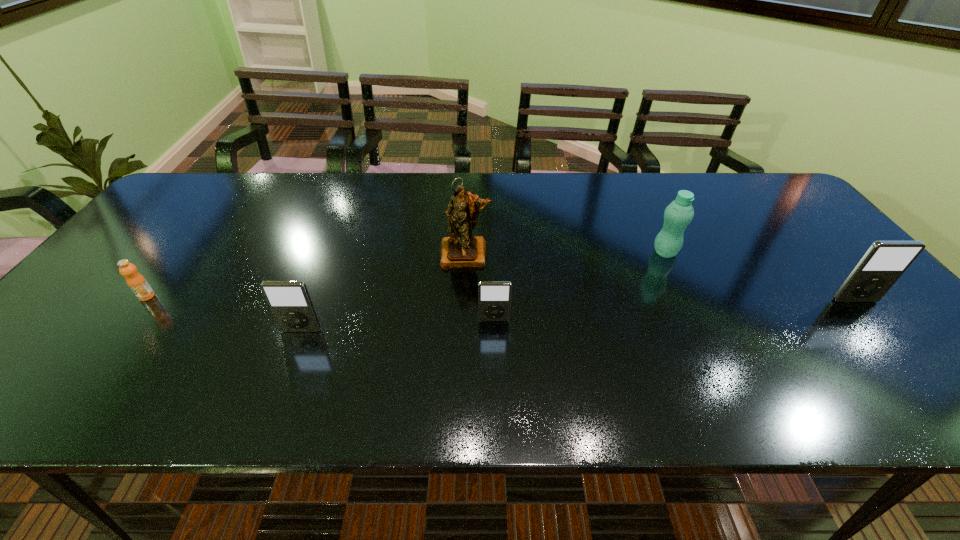
Where is `free space for an extra iPod to achieve even spacing`? The height and width of the screenshot is (540, 960). free space for an extra iPod to achieve even spacing is located at coordinates (679, 310).